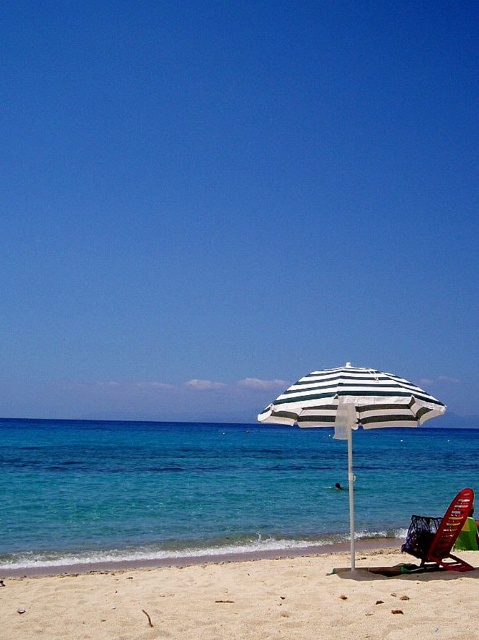
You are a photographer trying to capture the reflection of the white striped umbrella at center in the blue water at center. Based on the scene description, can you confirm if the reflection is visible?

The blue water at center is located below the white striped umbrella at center, so the reflection of the white striped umbrella at center should be visible in the blue water at center.

You are planning to take a photo of the blue water at center and the metallic red lounge chair at center from a position where both are visible. Which object will occupy more space in the photo?

The blue water at center is bigger than the metallic red lounge chair at center, so it will occupy more space in the photo.